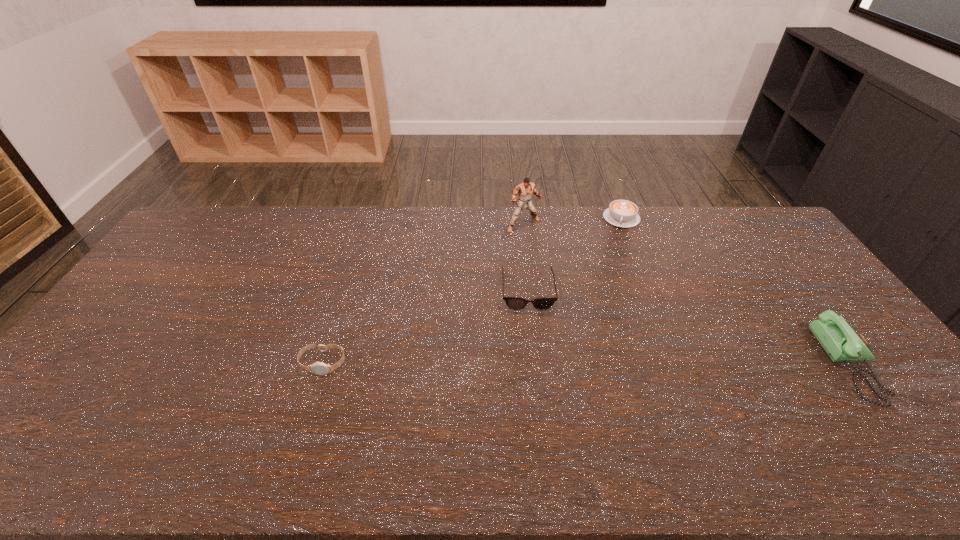
Find the location of a particular element. Image resolution: width=960 pixels, height=540 pixels. watch is located at coordinates (319, 368).

At what (x,y) coordinates should I click in order to perform the action: click on the rightmost object. Please return your answer as a coordinate pair (x, y). The width and height of the screenshot is (960, 540). Looking at the image, I should click on (838, 339).

Where is `the second tallest object`? the second tallest object is located at coordinates (838, 339).

Identify the location of the tallest object. (525, 189).

Where is `the third nearest object`? This screenshot has height=540, width=960. the third nearest object is located at coordinates (516, 303).

The image size is (960, 540). I want to click on the fourth object from left to right, so click(622, 213).

Find the location of a particular element. This screenshot has width=960, height=540. vacant space located 0.080m on the face of the leftmost object is located at coordinates (310, 403).

I want to click on vacant space located 0.150m on the front-facing side of the puncher, so click(551, 258).

Where is `vacant space located 0.310m on the front-facing side of the puncher`? This screenshot has width=960, height=540. vacant space located 0.310m on the front-facing side of the puncher is located at coordinates (575, 288).

Where is `free region located on the front-facing side of the puncher`? This screenshot has width=960, height=540. free region located on the front-facing side of the puncher is located at coordinates (544, 249).